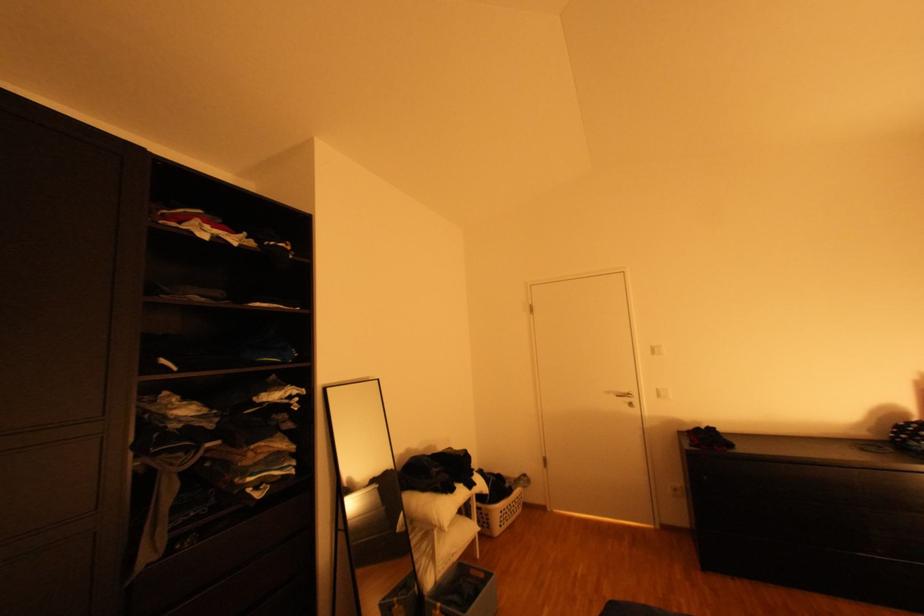
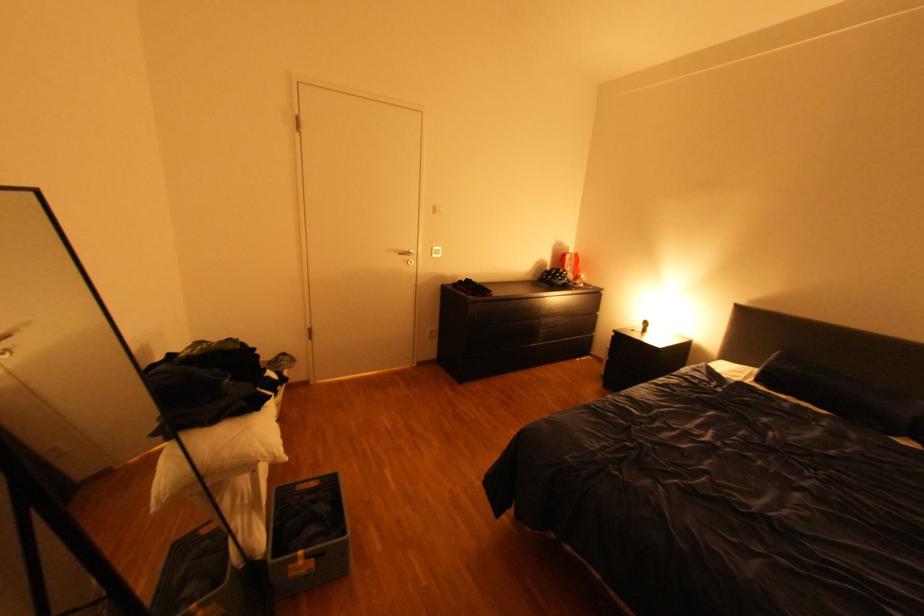
Find the pixel in the second image that matches the point at 482,572 in the first image.

(310, 488)